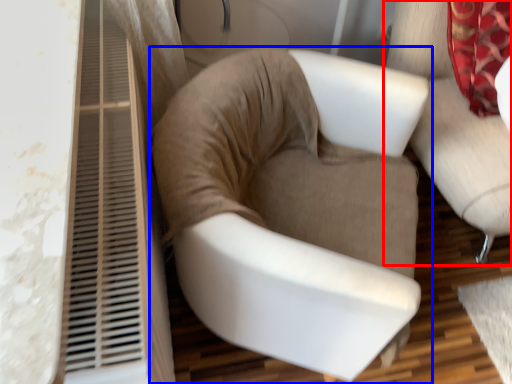
Question: Which object appears farthest to the camera in this image, chair (highlighted by a red box) or chair (highlighted by a blue box)?

Choices:
 (A) chair
 (B) chair

Answer: (A)